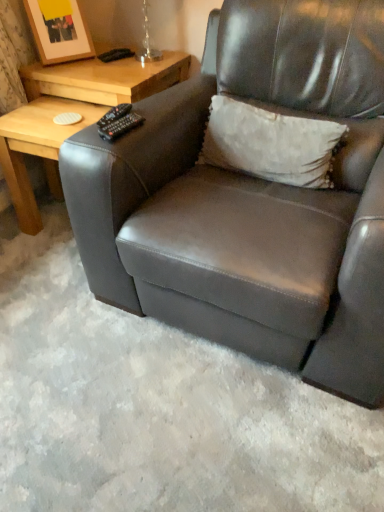
Question: Does light brown wood table at upper left, the first table in the top-to-bottom sequence, contain wooden picture frame at upper left?

Choices:
 (A) no
 (B) yes

Answer: (A)

Question: From the image's perspective, is light brown wood table at upper left, the first table in the top-to-bottom sequence, above wooden picture frame at upper left?

Choices:
 (A) no
 (B) yes

Answer: (A)

Question: Is light brown wood table at upper left, the first table in the top-to-bottom sequence, wider than wooden picture frame at upper left?

Choices:
 (A) no
 (B) yes

Answer: (B)

Question: Is light brown wood table at upper left, the 2th table in the bottom-to-top sequence, with wooden picture frame at upper left?

Choices:
 (A) yes
 (B) no

Answer: (B)

Question: Can you confirm if light brown wood table at upper left, the 2th table in the bottom-to-top sequence, is thinner than wooden picture frame at upper left?

Choices:
 (A) no
 (B) yes

Answer: (A)

Question: Does point (337, 181) appear closer or farther from the camera than point (46, 15)?

Choices:
 (A) closer
 (B) farther

Answer: (A)

Question: From a real-world perspective, is matte black armchair at center physically located above or below wooden picture frame at upper left?

Choices:
 (A) below
 (B) above

Answer: (A)

Question: In terms of width, does matte black armchair at center look wider or thinner when compared to wooden picture frame at upper left?

Choices:
 (A) wide
 (B) thin

Answer: (A)

Question: From the image's perspective, is matte black armchair at center located above or below wooden picture frame at upper left?

Choices:
 (A) below
 (B) above

Answer: (A)

Question: From the image's perspective, is light wood table at left, which is counted as the 1th table, starting from the bottom, positioned above or below light brown wood table at upper left, the 2th table in the bottom-to-top sequence?

Choices:
 (A) below
 (B) above

Answer: (A)

Question: Is light wood table at left, placed as the 2th table when sorted from top to bottom, spatially inside light brown wood table at upper left, the 2th table in the bottom-to-top sequence, or outside of it?

Choices:
 (A) inside
 (B) outside

Answer: (B)

Question: Is point (26, 178) positioned closer to the camera than point (26, 224)?

Choices:
 (A) farther
 (B) closer

Answer: (B)

Question: Considering the relative positions of light wood table at left, placed as the 2th table when sorted from top to bottom, and light brown wood table at upper left, the 2th table in the bottom-to-top sequence, in the image provided, is light wood table at left, placed as the 2th table when sorted from top to bottom, to the left or to the right of light brown wood table at upper left, the 2th table in the bottom-to-top sequence,?

Choices:
 (A) left
 (B) right

Answer: (A)

Question: Is white textured pillow at upper center to the left or to the right of matte black armchair at center in the image?

Choices:
 (A) right
 (B) left

Answer: (B)

Question: Considering the positions of white textured pillow at upper center and matte black armchair at center in the image, is white textured pillow at upper center bigger or smaller than matte black armchair at center?

Choices:
 (A) big
 (B) small

Answer: (B)